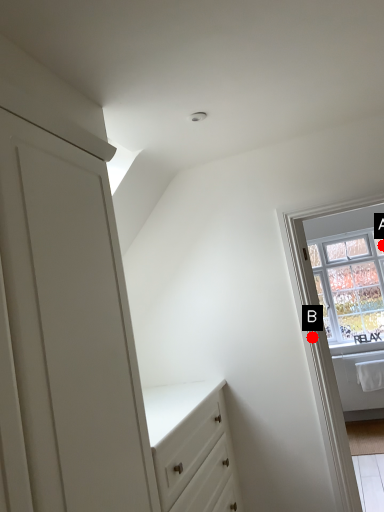
Question: Two points are circled on the image, labeled by A and B beside each circle. Among these points, which one is farthest from the camera?

Choices:
 (A) A is further
 (B) B is further

Answer: (A)